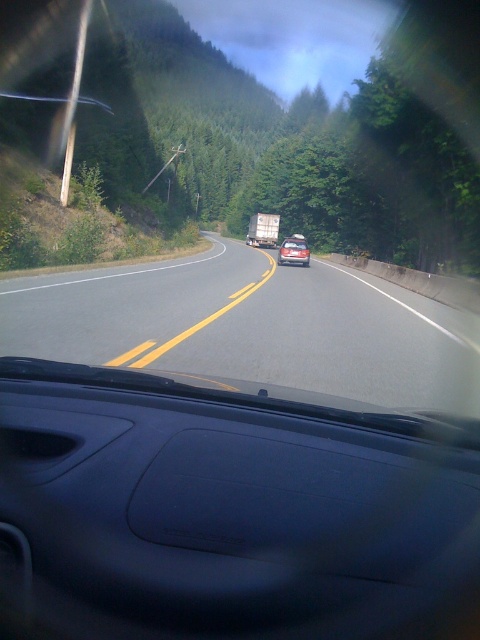
Measure the distance between green leafy tree at upper center and metallic silver trailer truck at center.

The distance of green leafy tree at upper center from metallic silver trailer truck at center is 133.25 feet.

Consider the image. Who is taller, green leafy tree at upper center or metallic silver trailer truck at center?

With more height is green leafy tree at upper center.

What do you see at coordinates (289, 136) in the screenshot? The height and width of the screenshot is (640, 480). I see `green leafy tree at upper center` at bounding box center [289, 136].

This screenshot has height=640, width=480. What are the coordinates of `green leafy tree at upper center` in the screenshot? It's located at (289, 136).

Does smooth asphalt road at center appear on the left side of metallic silver trailer truck at center?

Yes, smooth asphalt road at center is to the left of metallic silver trailer truck at center.

Can you confirm if smooth asphalt road at center is smaller than metallic silver trailer truck at center?

No, smooth asphalt road at center is not smaller than metallic silver trailer truck at center.

Is point (24, 321) closer to viewer compared to point (247, 240)?

Yes, point (24, 321) is closer to viewer.

Where is `smooth asphalt road at center`? smooth asphalt road at center is located at coordinates (252, 326).

Consider the image. Is transparent plastic car window at center to the right of metallic silver trailer truck at center from the viewer's perspective?

No, transparent plastic car window at center is not to the right of metallic silver trailer truck at center.

Between point (54, 600) and point (262, 224), which one is positioned in front?

Point (54, 600) is more forward.

Identify the location of transparent plastic car window at center. [228, 512].